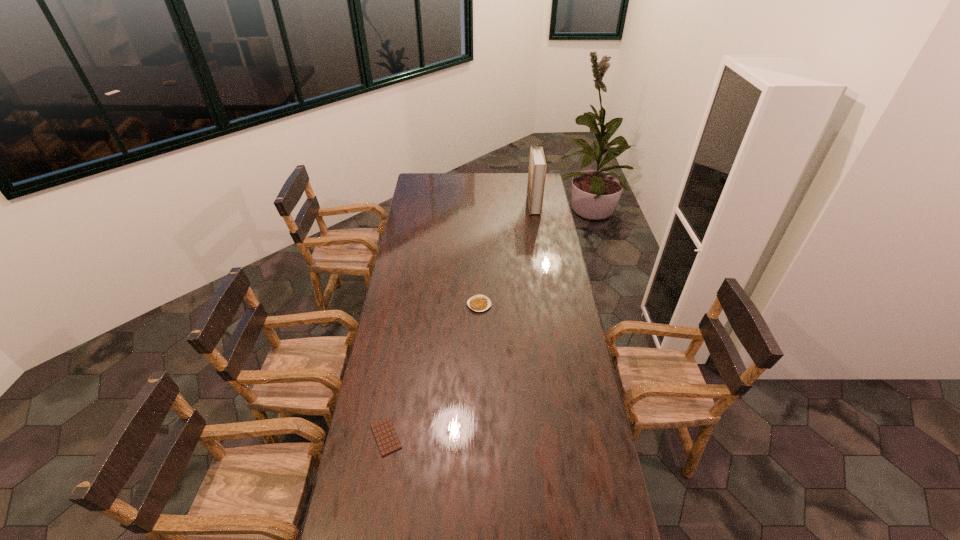
At what (x,y) coordinates should I click in order to perform the action: click on the closest object to the farthest object. Please return your answer as a coordinate pair (x, y). This screenshot has width=960, height=540. Looking at the image, I should click on (479, 303).

Locate an element on the screen. object that is the second nearest to the tallest object is located at coordinates (387, 440).

Identify the location of free location that satisfies the following two spatial constraints: 1. on the back side of the leftmost object; 2. on the left side of the second shortest object. (408, 305).